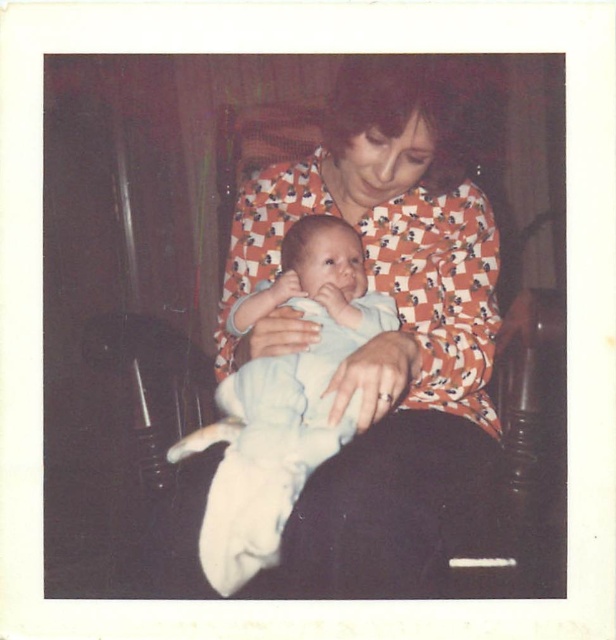
Which is more to the left, orange printed blouse at center or light blue cotton baby at center?

Positioned to the left is light blue cotton baby at center.

Can you confirm if orange printed blouse at center is bigger than light blue cotton baby at center?

Yes, orange printed blouse at center is bigger than light blue cotton baby at center.

Does point (463, 413) come behind point (285, 461)?

Yes, point (463, 413) is behind point (285, 461).

What are the coordinates of `orange printed blouse at center` in the screenshot? It's located at (386, 333).